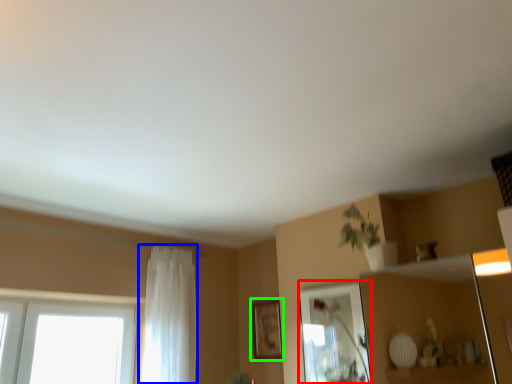
Question: Based on their relative distances, which object is farther from mirror (highlighted by a red box)? Choose from curtain (highlighted by a blue box) and picture frame (highlighted by a green box).

Choices:
 (A) curtain
 (B) picture frame

Answer: (A)